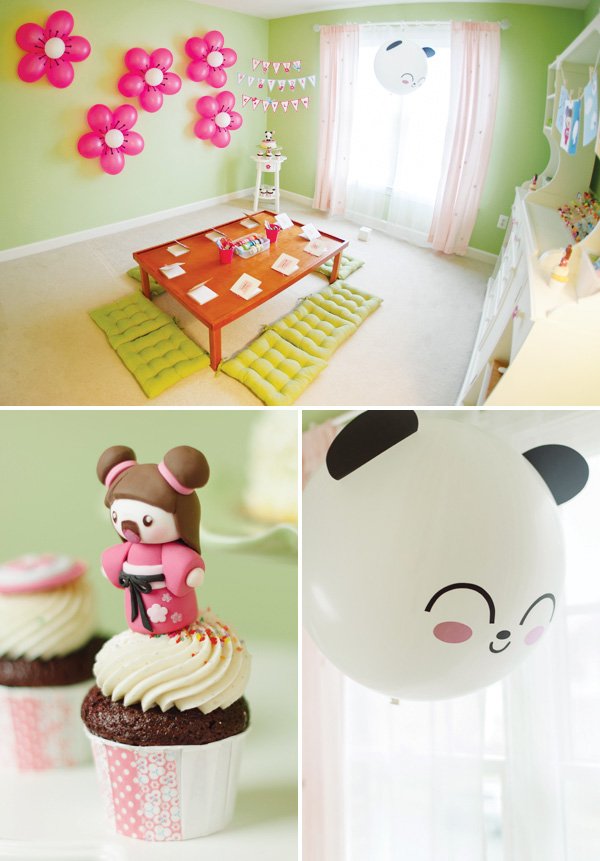
The image size is (600, 861). I want to click on pink flower decoration, so click(x=31, y=39), click(x=136, y=59), click(x=203, y=106), click(x=196, y=46), click(x=100, y=115).